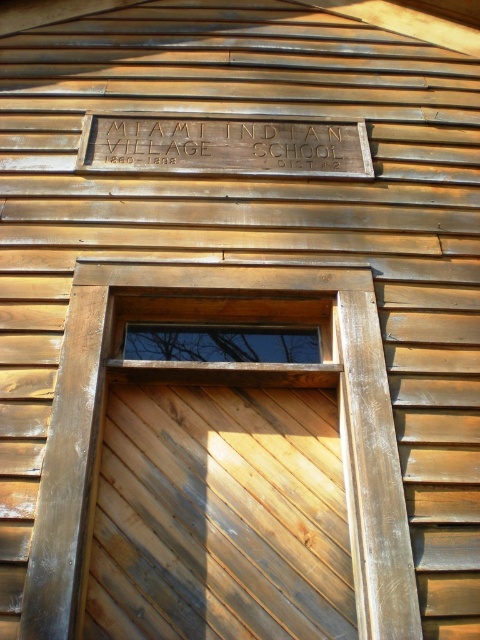
Which is above, wooden sign at center or transparent glass window at center?

wooden sign at center is above.

Does wooden sign at center lie in front of transparent glass window at center?

No.

Where is `wooden sign at center`? wooden sign at center is located at coordinates click(225, 147).

Does wooden frame window at center appear over transparent glass window at center?

Incorrect, wooden frame window at center is not positioned above transparent glass window at center.

Does point (56, 470) come in front of point (158, 352)?

Yes, it is in front of point (158, 352).

The height and width of the screenshot is (640, 480). I want to click on wooden frame window at center, so click(340, 433).

Is wooden frame window at center below wooden sign at center?

Yes, wooden frame window at center is below wooden sign at center.

Is point (380, 547) farther from viewer compared to point (257, 150)?

No.

Between point (86, 417) and point (149, 163), which one is positioned in front?

Point (86, 417) is in front.

Find the location of a particular element. This screenshot has height=640, width=480. wooden frame window at center is located at coordinates (340, 433).